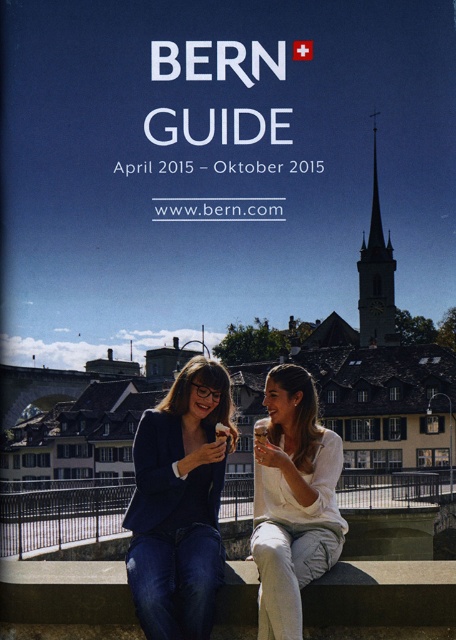
You are a tailor measuring the distance between two clothing items on a guidebook cover. The items are the matte black blazer at center and the white cotton shirt at center. The minimum space required for your measuring tape to fit between them is 40 inches. Can your tape measure fit between them?

The matte black blazer at center and white cotton shirt at center are 38.25 inches apart, which is less than the 40 inches required. Therefore, the measuring tape cannot fit between them.

You are looking at the cover of a BERN guidebook. There are two people on the cover wearing a matte black blazer at center and a white cotton shirt at center. Which one is on the left side?

The matte black blazer at center is to the left of white cotton shirt at center, so the person wearing the matte black blazer at center is on the left side.

You are a photographer trying to capture the woman wearing the matte black blazer at center and the translucent glass beverage at center in the same frame. Based on their positions, will the beverage be visible behind the blazer in your photo?

The matte black blazer at center is in front of the translucent glass beverage at center, so the beverage will be visible behind the blazer in the photo since it is translucent and the blazer is in front.